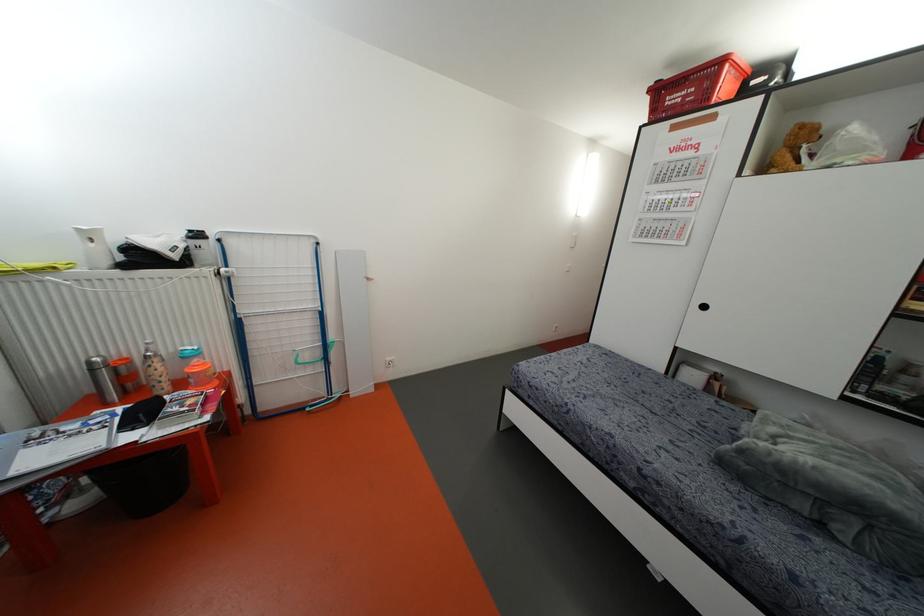
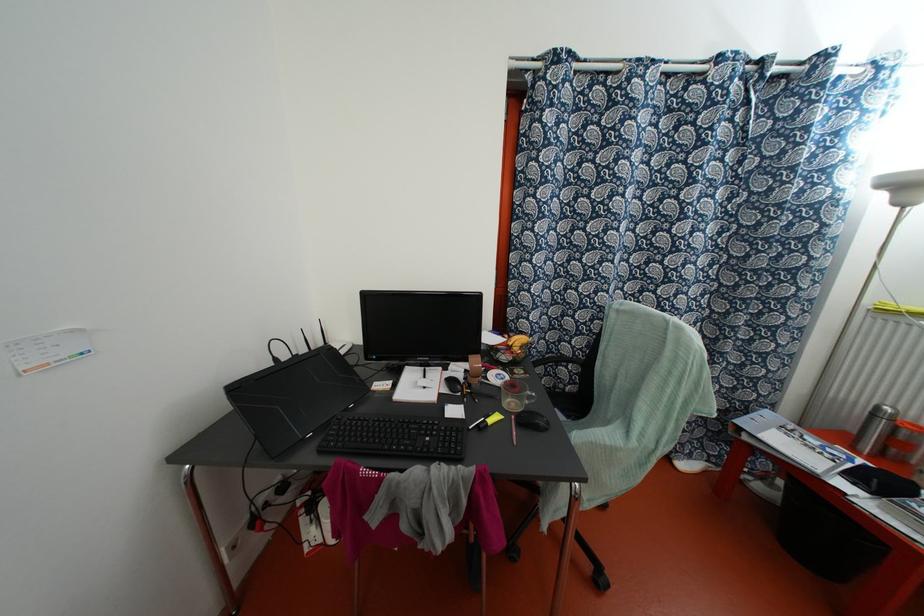
In the second image, find the point that corresponds to point 91,370 in the first image.

(872, 415)